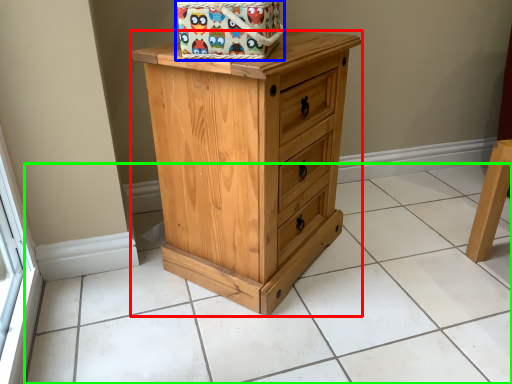
Question: Which object is positioned closest to chest of drawers (highlighted by a red box)? Select from gift basket (highlighted by a blue box) and tile (highlighted by a green box).

Choices:
 (A) gift basket
 (B) tile

Answer: (A)